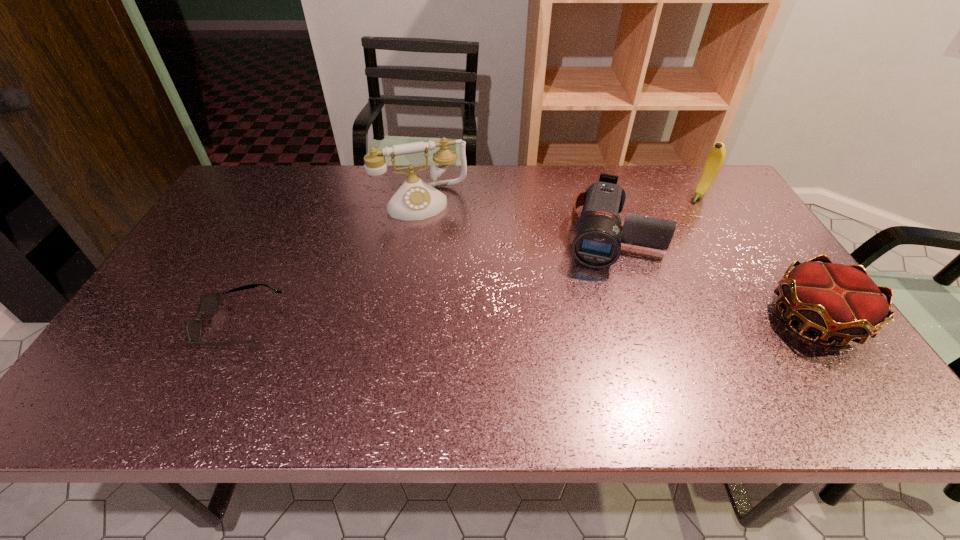
You are a GUI agent. You are given a task and a screenshot of the screen. Output one action in this format:
    pyautogui.click(x=<x>, y=<y>)
    Task: Click on the camcorder that is at the far edge
    The image size is (960, 540).
    Given the screenshot: What is the action you would take?
    point(597,244)

The width and height of the screenshot is (960, 540). Identify the location of sunglasses at the near edge. (208, 305).

Identify the location of crown at the near edge. The image size is (960, 540). [840, 301].

You are a GUI agent. You are given a task and a screenshot of the screen. Output one action in this format:
    pyautogui.click(x=<x>, y=<y>)
    Task: Click on the object present at the left edge
    The height and width of the screenshot is (540, 960).
    Given the screenshot: What is the action you would take?
    pyautogui.click(x=208, y=305)

Find the location of a particular element. The width and height of the screenshot is (960, 540). crown that is at the right edge is located at coordinates (840, 301).

Where is `banana that is at the right edge`? The height and width of the screenshot is (540, 960). banana that is at the right edge is located at coordinates (715, 158).

In order to click on object that is at the near left corner in this screenshot , I will do `click(208, 305)`.

Find the location of a particular element. This screenshot has width=960, height=540. object that is positioned at the far right corner is located at coordinates (715, 158).

Identify the location of object situated at the near right corner. (840, 301).

Where is `vacant space at the far edge`? vacant space at the far edge is located at coordinates (507, 199).